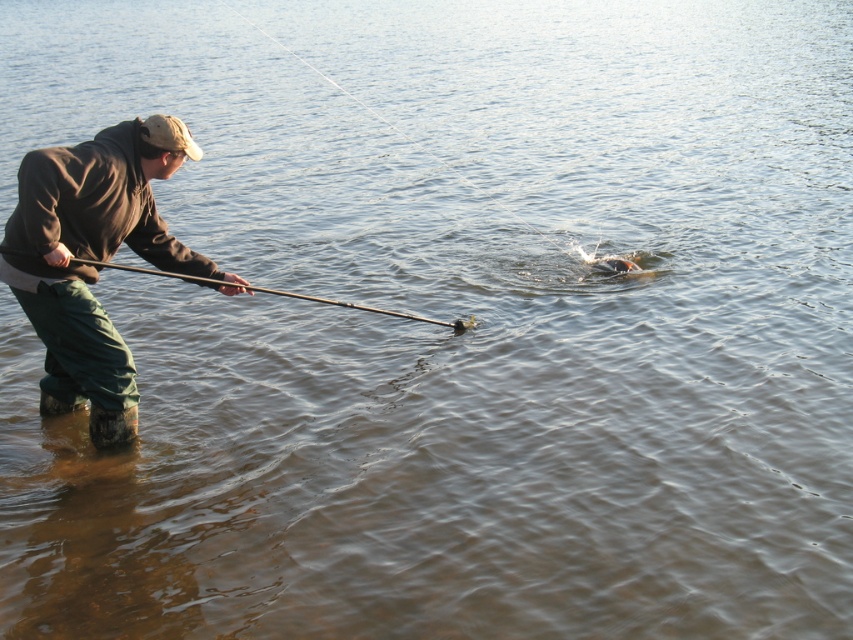
Question: Is brown fabric jacket at left closer to the viewer compared to smooth black rod at center?

Choices:
 (A) no
 (B) yes

Answer: (B)

Question: Is brown fabric jacket at left in front of smooth black rod at center?

Choices:
 (A) yes
 (B) no

Answer: (A)

Question: Does brown fabric jacket at left lie in front of smooth black rod at center?

Choices:
 (A) yes
 (B) no

Answer: (A)